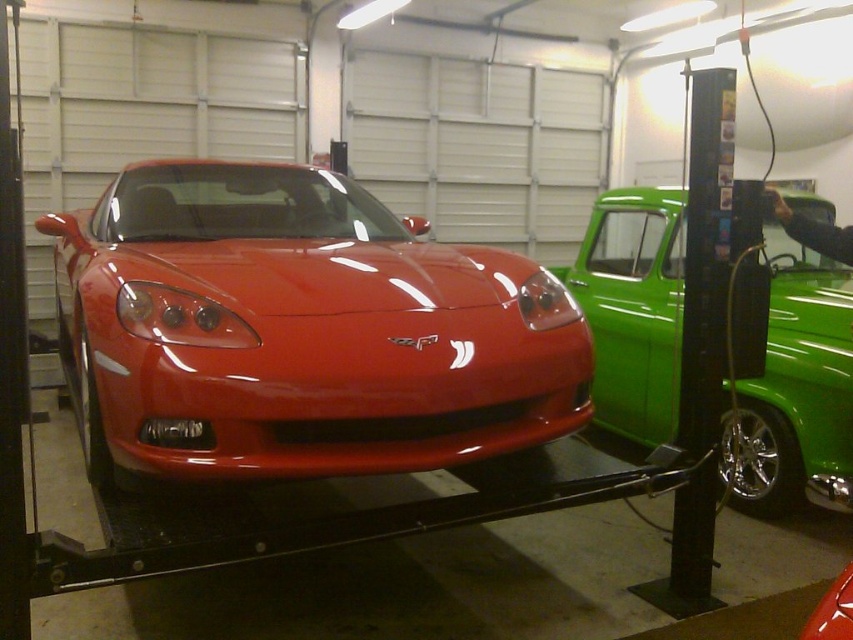
Consider the image. Can you confirm if glossy red sports car at center is wider than green glossy pickup truck at right?

Yes, glossy red sports car at center is wider than green glossy pickup truck at right.

Looking at this image, is glossy red sports car at center above green glossy pickup truck at right?

Yes.

Measure the distance between point (299, 202) and camera.

Point (299, 202) and camera are 3.70 meters apart from each other.

At what (x,y) coordinates should I click in order to perform the action: click on glossy red sports car at center. Please return your answer as a coordinate pair (x, y). Looking at the image, I should click on (299, 330).